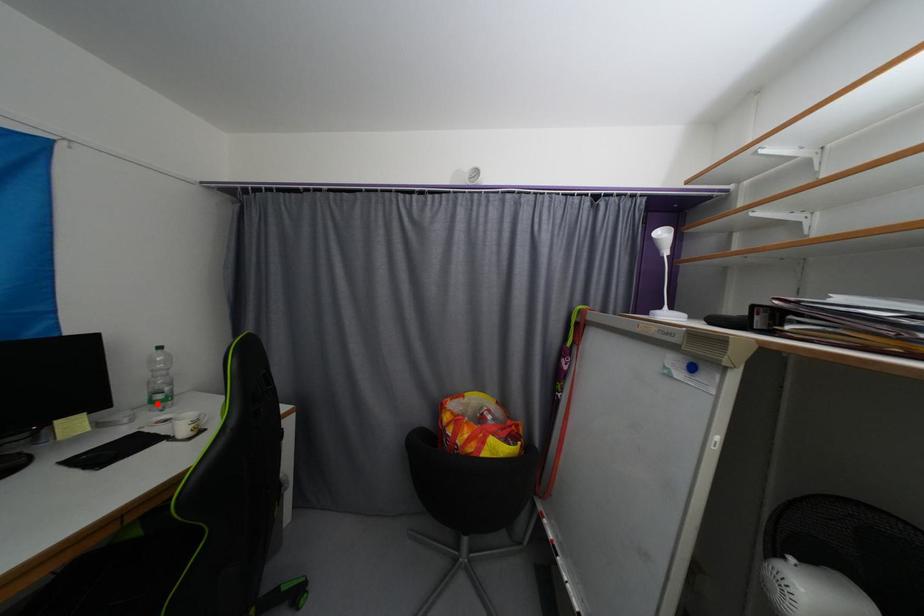
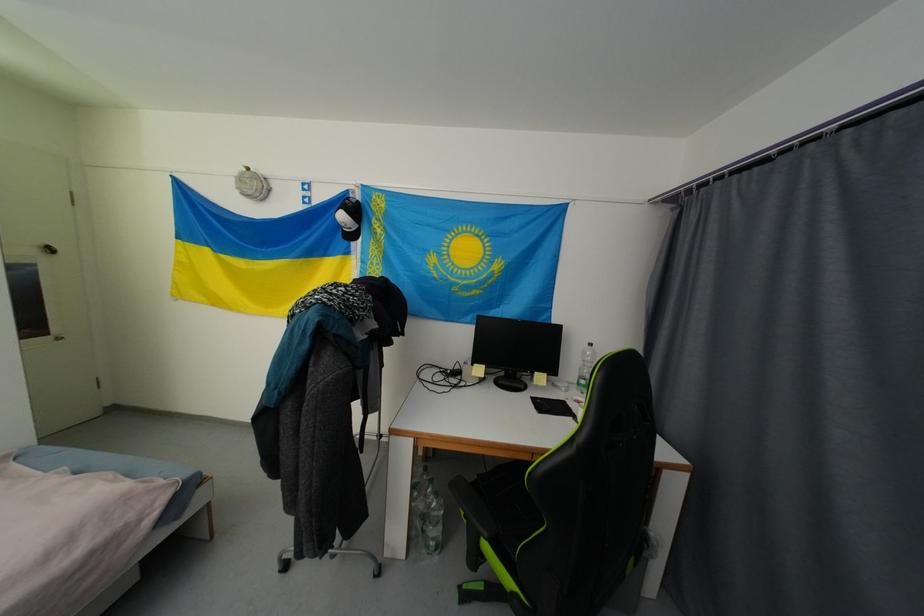
Locate, in the second image, the point that corresponds to the highlighted location in the first image.

(584, 386)